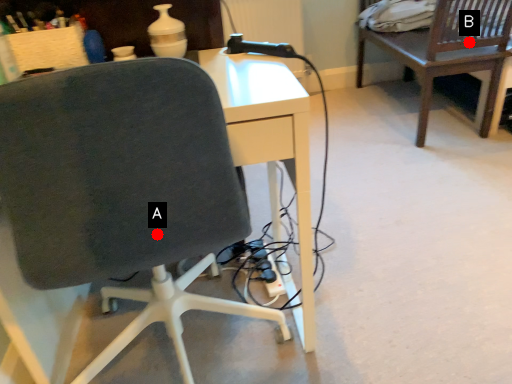
Question: Two points are circled on the image, labeled by A and B beside each circle. Which point is closer to the camera taking this photo?

Choices:
 (A) A is closer
 (B) B is closer

Answer: (A)